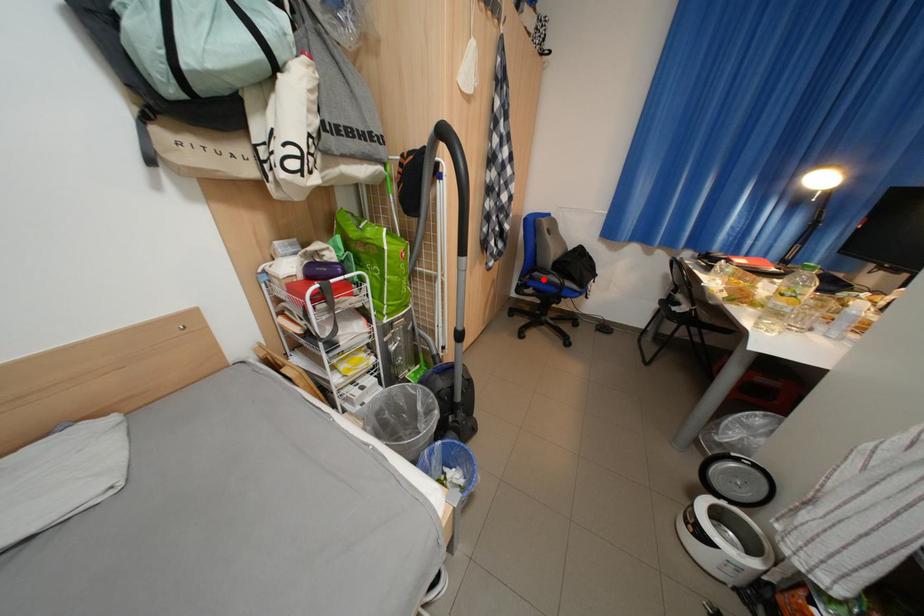
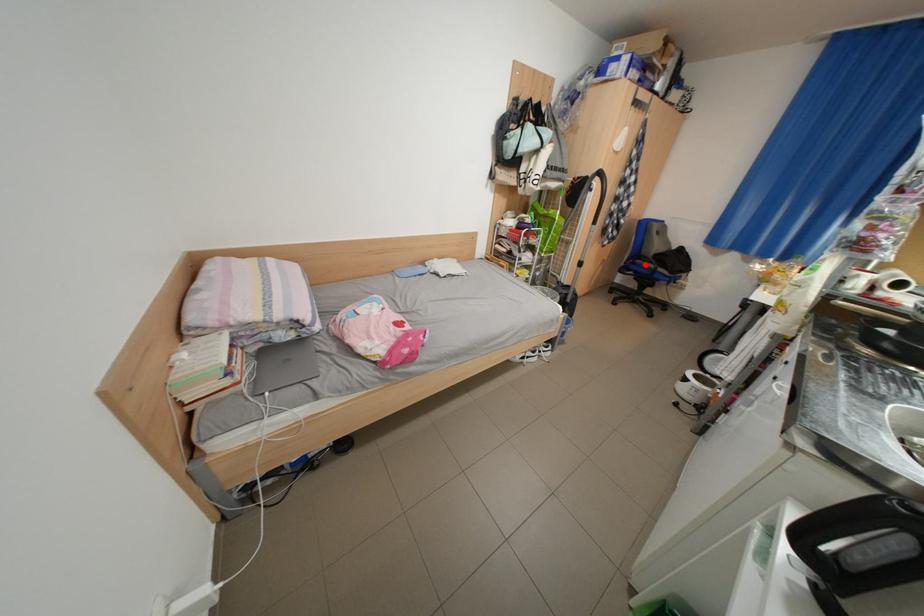
I am providing you with two images of the same scene from different viewpoints. A red point is marked on the first image and another point is marked on the second image. Are the points marked in image1 and image2 representing the same 3D position?

Yes